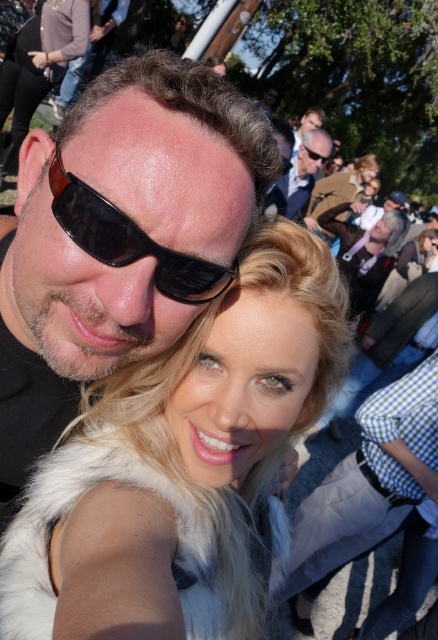
You are standing at the center of the image and want to reach both the black matte sunglasses at center and the black plastic sunglasses at upper center. Which pair of sunglasses is closer to you?

The black matte sunglasses at center is closer to you because it is located at the center of the image, while the black plastic sunglasses at upper center is positioned further away at upper center.

Consider the image. You are taking a photo of the two people in the scene. The matte black sunglasses at center is represented by point (119, 236). Which of the two individuals is wearing the matte black sunglasses at center?

The matte black sunglasses at center is worn by the person on the left.

You are taking a photo of two friends at an outdoor event. You notice the blonde fur coat at center and the blonde hair at center. Which object is positioned lower in the image?

The blonde fur coat at center is below blonde hair at center, so the blonde fur coat at center is positioned lower in the image.